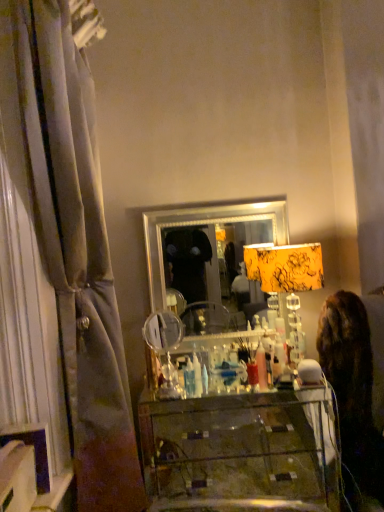
Question: Considering the relative sizes of yellow floral fabric lampshade at center and silver/metallic mirror at center in the image provided, is yellow floral fabric lampshade at center bigger than silver/metallic mirror at center?

Choices:
 (A) no
 (B) yes

Answer: (B)

Question: Can you confirm if yellow floral fabric lampshade at center is positioned to the left of silver/metallic mirror at center?

Choices:
 (A) yes
 (B) no

Answer: (B)

Question: Is yellow floral fabric lampshade at center positioned with its back to silver/metallic mirror at center?

Choices:
 (A) no
 (B) yes

Answer: (B)

Question: Can you confirm if yellow floral fabric lampshade at center is taller than silver/metallic mirror at center?

Choices:
 (A) no
 (B) yes

Answer: (A)

Question: Does yellow floral fabric lampshade at center have a lesser height compared to silver/metallic mirror at center?

Choices:
 (A) yes
 (B) no

Answer: (A)

Question: Looking at the image, does dark brown fur at right seem bigger or smaller compared to silky gray curtain at left?

Choices:
 (A) small
 (B) big

Answer: (A)

Question: Is point (347, 461) positioned closer to the camera than point (82, 86)?

Choices:
 (A) farther
 (B) closer

Answer: (A)

Question: Is dark brown fur at right wider or thinner than silky gray curtain at left?

Choices:
 (A) wide
 (B) thin

Answer: (B)

Question: From the image's perspective, is dark brown fur at right positioned above or below silky gray curtain at left?

Choices:
 (A) below
 (B) above

Answer: (A)

Question: From a real-world perspective, is silky gray curtain at left above or below silver/metallic mirror at center?

Choices:
 (A) above
 (B) below

Answer: (A)

Question: Considering the positions of silky gray curtain at left and silver/metallic mirror at center in the image, is silky gray curtain at left bigger or smaller than silver/metallic mirror at center?

Choices:
 (A) small
 (B) big

Answer: (B)

Question: Would you say silky gray curtain at left is to the left or to the right of silver/metallic mirror at center in the picture?

Choices:
 (A) right
 (B) left

Answer: (B)

Question: From the image's perspective, is silky gray curtain at left located above or below silver/metallic mirror at center?

Choices:
 (A) below
 (B) above

Answer: (B)

Question: From the image's perspective, is transparent glass vanity at center positioned above or below silver/metallic mirror at center?

Choices:
 (A) above
 (B) below

Answer: (B)

Question: In the image, is transparent glass vanity at center positioned in front of or behind silver/metallic mirror at center?

Choices:
 (A) behind
 (B) front

Answer: (B)